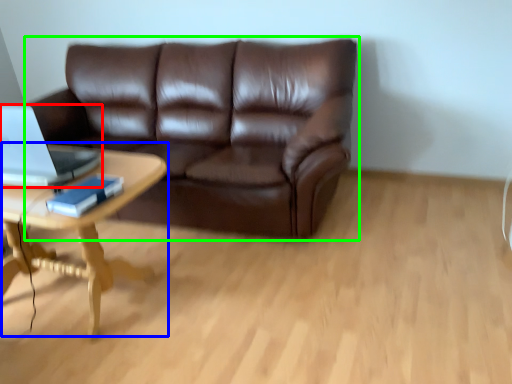
Question: Estimate the real-world distances between objects in this image. Which object is farther from laptop (highlighted by a red box), coffee table (highlighted by a blue box) or studio couch (highlighted by a green box)?

Choices:
 (A) coffee table
 (B) studio couch

Answer: (B)